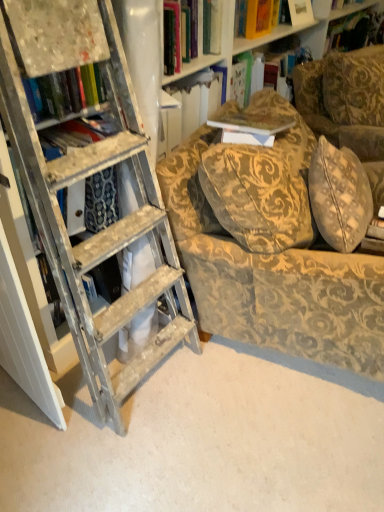
Question: Is point (244, 104) closer or farther from the camera than point (231, 308)?

Choices:
 (A) farther
 (B) closer

Answer: (A)

Question: Would you say hardcover book at upper center is to the left or to the right of gold-patterned fabric chair at center in the picture?

Choices:
 (A) right
 (B) left

Answer: (A)

Question: Looking at the image, does hardcover book at upper center seem bigger or smaller compared to gold-patterned fabric chair at center?

Choices:
 (A) small
 (B) big

Answer: (A)

Question: Based on their positions, is gold-patterned fabric chair at center located to the left or right of hardcover book at upper center?

Choices:
 (A) right
 (B) left

Answer: (B)

Question: From the image's perspective, relative to hardcover book at upper center, is gold-patterned fabric chair at center above or below?

Choices:
 (A) below
 (B) above

Answer: (A)

Question: In terms of width, does gold-patterned fabric chair at center look wider or thinner when compared to hardcover book at upper center?

Choices:
 (A) wide
 (B) thin

Answer: (A)

Question: From their relative heights in the image, would you say gold-patterned fabric chair at center is taller or shorter than hardcover book at upper center?

Choices:
 (A) short
 (B) tall

Answer: (B)